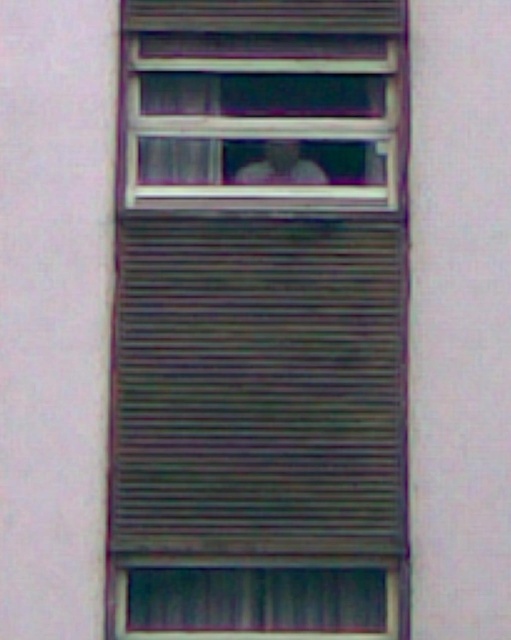
You are standing in front of a building with a window that has a metallic gray shutter at center. If you want to open the shutter, which direction should you move it to? Please answer based on its current position and the building facade description.

The metallic gray shutter at center is located at point (259, 385). Since the window has horizontal blinds and the shutter is at the center, moving it upwards would allow light to enter while maintaining privacy, as is common with such window designs.

You are standing outside the building and see the metallic gray shutter at center and the light skin tone human face at center through the window. Which object is blocking your view of the other?

The metallic gray shutter at center is closer to the viewer than the light skin tone human face at center, so it is blocking the view of the light skin tone human face at center.

You are standing in front of a building with a window that has horizontal blinds. You notice a point marked at coordinates (x=259, y=385). Based on the scene description, can you determine what object this point is located on?

The point (x=259, y=385) is on metallic gray shutter at center.